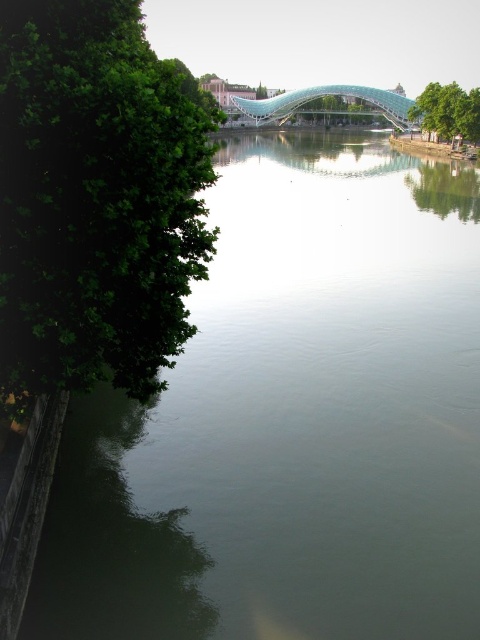
You are standing at the riverside and want to take a photo that includes both the dense green foliage on the left and the modern bridge in the background. Which point, point [61,96] or point [419,102], is closer to your current position?

Point [61,96] is closer to the camera than point [419,102], so it is closer to your current position.

You are standing at the point marked by the coordinates point (96, 196). Based on the scene description, what object is located at this point?

The point (96, 196) marks the green leafy tree at left.

You are standing at the point marked by the coordinates point (447, 112) in the riverside scene. What object is located at this point?

The point (447, 112) marks the green leafy tree at upper right.